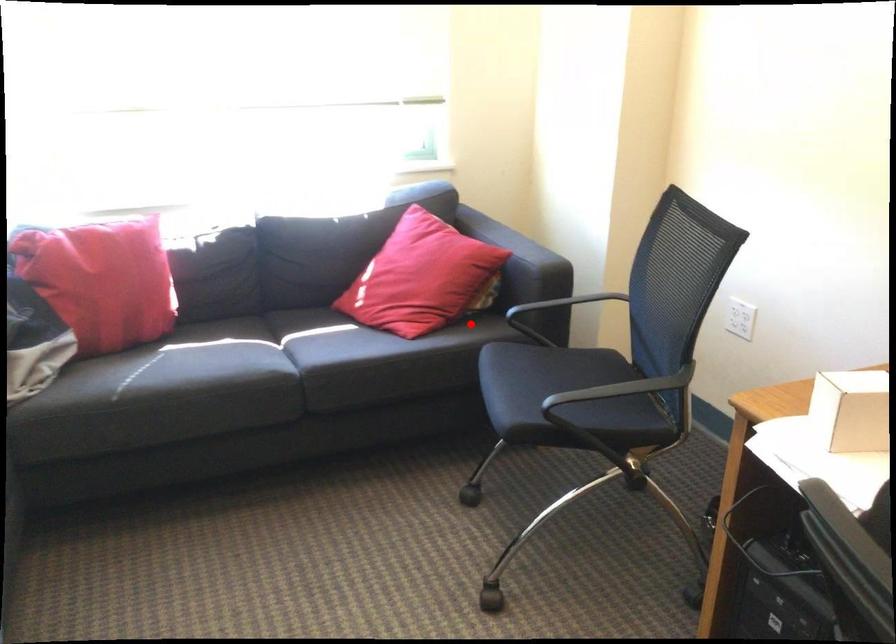
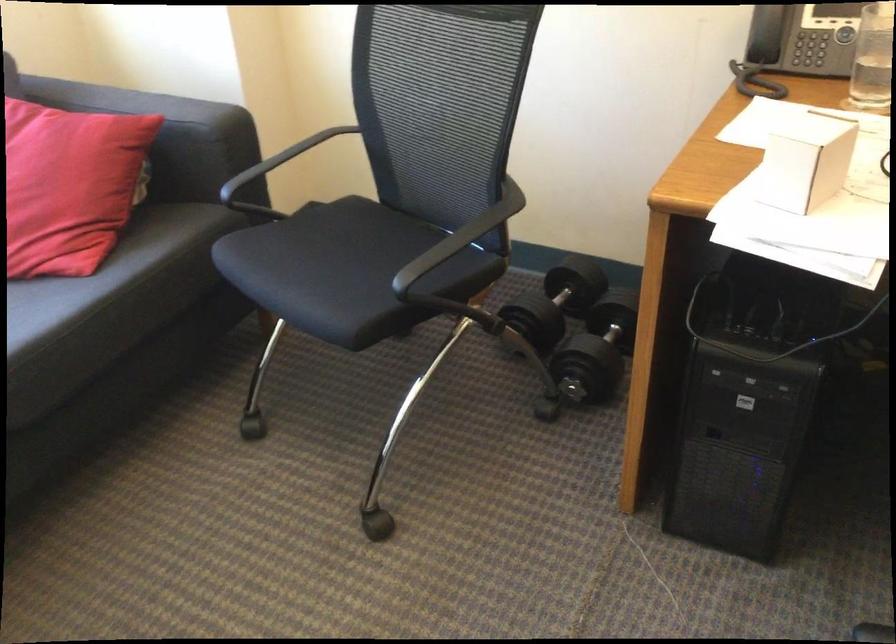
The point at the highlighted location is marked in the first image. Where is the corresponding point in the second image?

(156, 230)